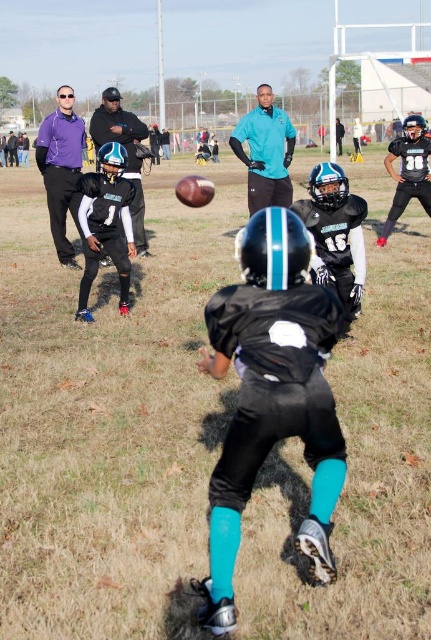
Question: Is purple matte shirt at left positioned behind matte black helmet at center?

Choices:
 (A) yes
 (B) no

Answer: (A)

Question: From the image, what is the correct spatial relationship of black matte football at center in relation to matte black helmet at center?

Choices:
 (A) below
 (B) above

Answer: (A)

Question: Which object is positioned closest to the black matte football at center?

Choices:
 (A) purple matte shirt at left
 (B) matte black helmet at center
 (C) teal synthetic jacket at center

Answer: (B)

Question: Estimate the real-world distances between objects in this image. Which object is closer to the purple matte shirt at left?

Choices:
 (A) black matte football at center
 (B) matte black helmet at center
 (C) teal synthetic jacket at center

Answer: (B)

Question: Which object is the farthest from the matte black helmet at center?

Choices:
 (A) purple matte shirt at left
 (B) teal synthetic jacket at center
 (C) black matte football at center

Answer: (C)

Question: Can you confirm if black matte football at center is smaller than purple matte shirt at left?

Choices:
 (A) yes
 (B) no

Answer: (A)